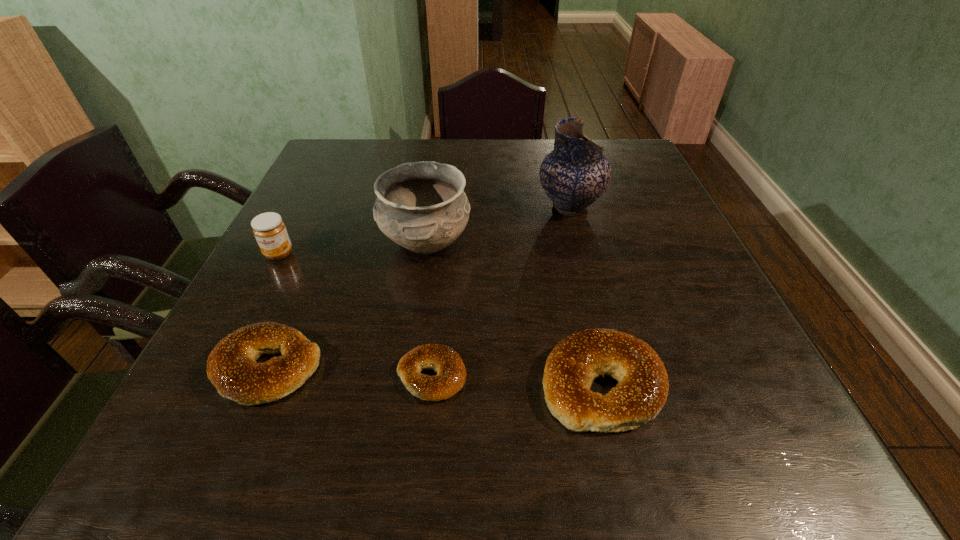
At what (x,y) coordinates should I click in order to perform the action: click on vacant space at the near edge. Please return your answer as a coordinate pair (x, y). This screenshot has height=540, width=960. Looking at the image, I should click on [398, 359].

In the image, there is a desktop. At what (x,y) coordinates should I click in order to perform the action: click on free space at the left edge. Please return your answer as a coordinate pair (x, y). Image resolution: width=960 pixels, height=540 pixels. Looking at the image, I should click on point(332,191).

Image resolution: width=960 pixels, height=540 pixels. Find the location of `vacant space at the right edge`. vacant space at the right edge is located at coordinates (680, 248).

Where is `free space at the far left corner of the desktop`? The image size is (960, 540). free space at the far left corner of the desktop is located at coordinates (336, 157).

Where is `free space at the far right corner`? Image resolution: width=960 pixels, height=540 pixels. free space at the far right corner is located at coordinates (613, 160).

You are a GUI agent. You are given a task and a screenshot of the screen. Output one action in this format:
    pyautogui.click(x=<x>, y=<y>)
    Task: Click on the unoccupied area between the jam and the rightmost bagel
    The height and width of the screenshot is (540, 960).
    Given the screenshot: What is the action you would take?
    pyautogui.click(x=441, y=319)

Where is `free spot between the rightmost bagel and the shortest object`? free spot between the rightmost bagel and the shortest object is located at coordinates (516, 380).

Find the location of a particular element. Image resolution: width=960 pixels, height=540 pixels. vacant area between the left pottery and the fifth tallest object is located at coordinates (347, 305).

Locate an element on the screen. The height and width of the screenshot is (540, 960). unoccupied area between the second bagel from left to right and the second tallest object is located at coordinates (429, 309).

This screenshot has height=540, width=960. What are the coordinates of `empty space that is in between the leftmost bagel and the shortest object` in the screenshot? It's located at (349, 372).